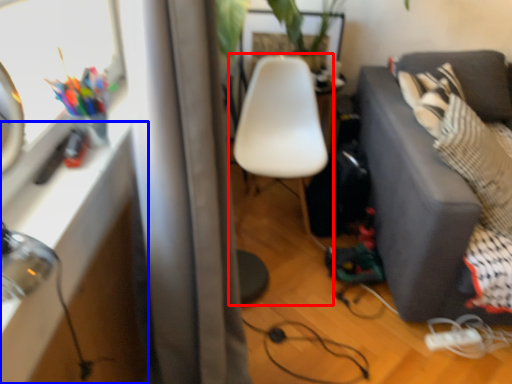
Question: Which object is further to the camera taking this photo, chair (highlighted by a red box) or table (highlighted by a blue box)?

Choices:
 (A) chair
 (B) table

Answer: (A)